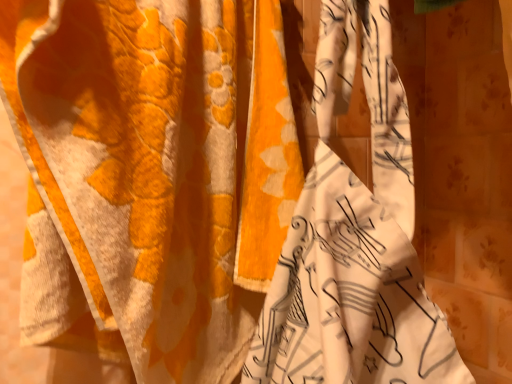
Question: From the image's perspective, is floral fabric curtain at center, which is the first curtain from right to left, above or below orange fabric curtain at center, acting as the first curtain starting from the left?

Choices:
 (A) below
 (B) above

Answer: (A)

Question: Does point (411, 342) appear closer or farther from the camera than point (236, 137)?

Choices:
 (A) closer
 (B) farther

Answer: (A)

Question: Considering the positions of floral fabric curtain at center, which is the first curtain from right to left, and orange fabric curtain at center, acting as the first curtain starting from the left, in the image, is floral fabric curtain at center, which is the first curtain from right to left, bigger or smaller than orange fabric curtain at center, acting as the first curtain starting from the left,?

Choices:
 (A) big
 (B) small

Answer: (B)

Question: From the image's perspective, relative to floral fabric curtain at center, which is the first curtain from right to left, is orange fabric curtain at center, acting as the first curtain starting from the left, above or below?

Choices:
 (A) above
 (B) below

Answer: (A)

Question: Based on their sizes in the image, would you say orange fabric curtain at center, acting as the first curtain starting from the left, is bigger or smaller than floral fabric curtain at center, which is the 2th curtain from left to right?

Choices:
 (A) small
 (B) big

Answer: (B)

Question: In terms of height, does orange fabric curtain at center, acting as the first curtain starting from the left, look taller or shorter compared to floral fabric curtain at center, which is the 2th curtain from left to right?

Choices:
 (A) short
 (B) tall

Answer: (B)

Question: Based on their positions, is orange fabric curtain at center, placed as the second curtain when sorted from right to left, located to the left or right of floral fabric curtain at center, which is the first curtain from right to left?

Choices:
 (A) left
 (B) right

Answer: (A)